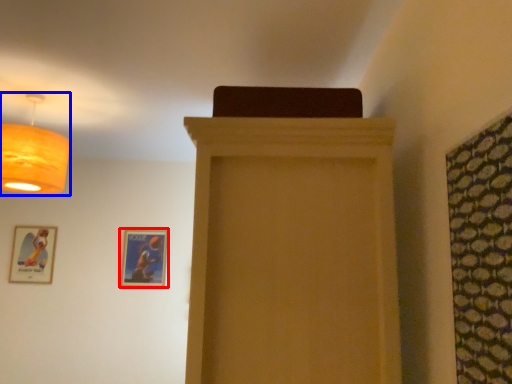
Question: Among these objects, which one is nearest to the camera, picture frame (highlighted by a red box) or lamp (highlighted by a blue box)?

Choices:
 (A) picture frame
 (B) lamp

Answer: (B)